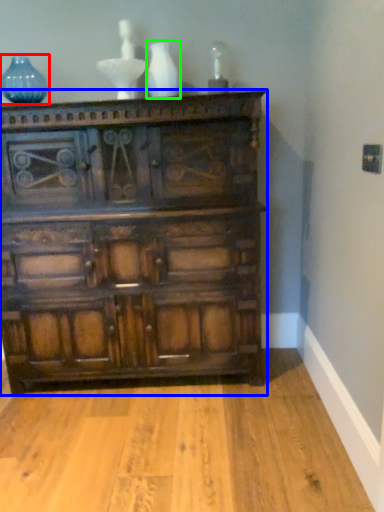
Question: Which is nearer to the glass vase (highlighted by a red box)? chest of drawers (highlighted by a blue box) or vase (highlighted by a green box).

Choices:
 (A) chest of drawers
 (B) vase

Answer: (B)